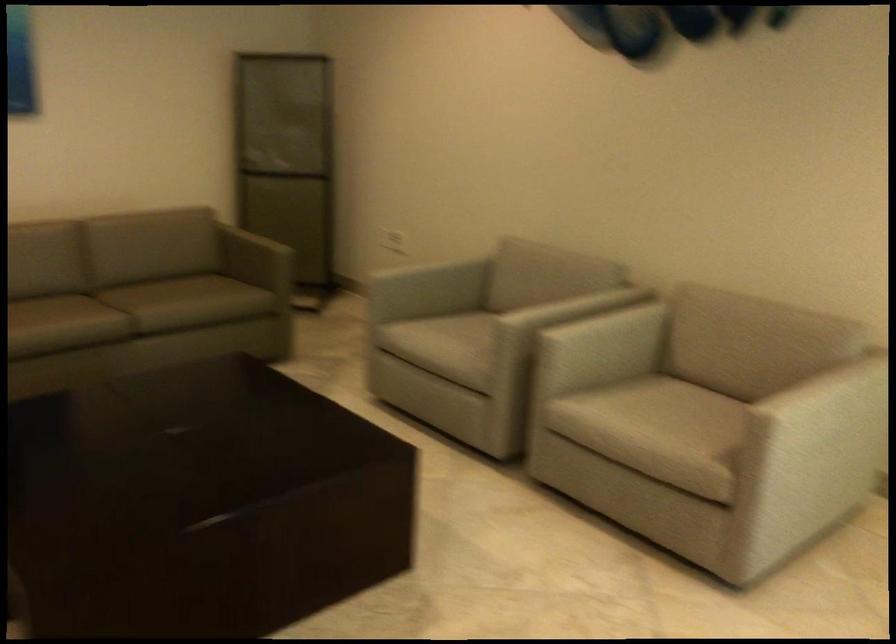
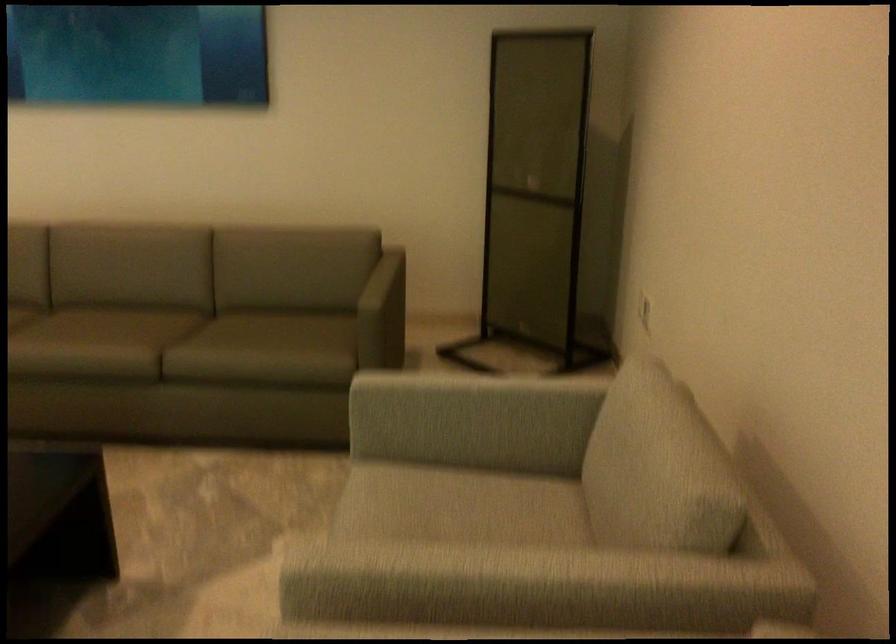
The point at (435, 319) is marked in the first image. Where is the corresponding point in the second image?

(455, 491)